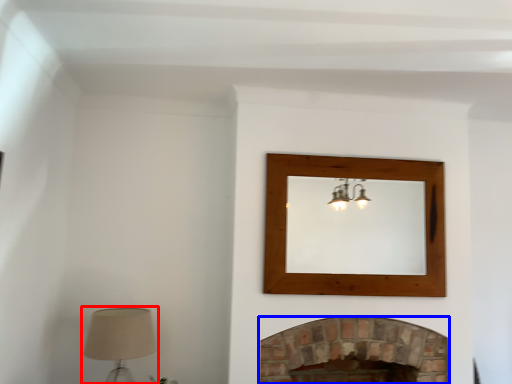
Question: Which object is closer to the camera taking this photo, table lamp (highlighted by a red box) or fireplace (highlighted by a blue box)?

Choices:
 (A) table lamp
 (B) fireplace

Answer: (A)